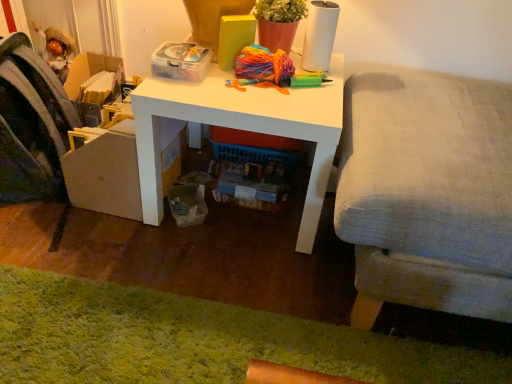
This screenshot has width=512, height=384. I want to click on vacant space situated above white matte desk at center (from a real-world perspective), so click(x=259, y=80).